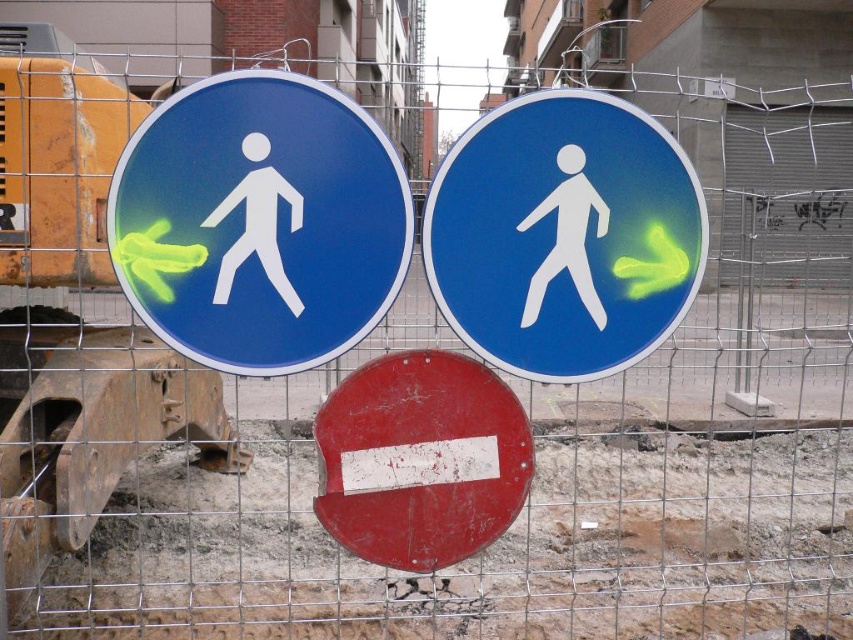
Question: Which point is farther to the camera?

Choices:
 (A) blue glossy pedestrian sign at upper left
 (B) blue glossy pedestrian sign at center
 (C) scratched red circle at center

Answer: (C)

Question: Is blue glossy pedestrian sign at upper left positioned in front of blue glossy pedestrian sign at center?

Choices:
 (A) yes
 (B) no

Answer: (A)

Question: Is blue glossy pedestrian sign at center behind scratched red circle at center?

Choices:
 (A) yes
 (B) no

Answer: (B)

Question: Which of the following is the closest to the observer?

Choices:
 (A) scratched red circle at center
 (B) blue glossy pedestrian sign at upper left

Answer: (B)

Question: Which point is farther from the camera taking this photo?

Choices:
 (A) (450, 483)
 (B) (537, 205)
 (C) (399, 227)

Answer: (A)

Question: Is blue glossy pedestrian sign at upper left to the right of scratched red circle at center from the viewer's perspective?

Choices:
 (A) yes
 (B) no

Answer: (B)